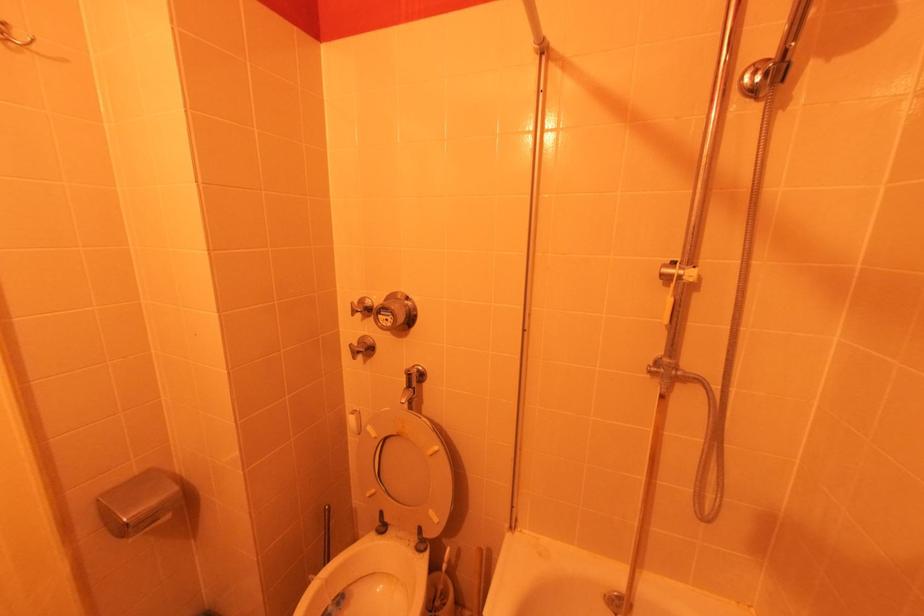
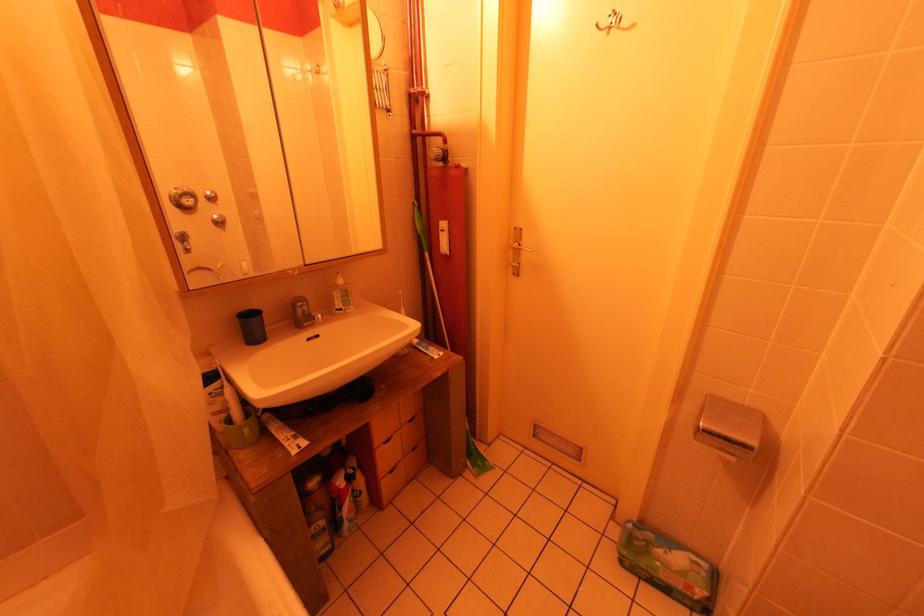
The first image is from the beginning of the video and the second image is from the end. How did the camera likely rotate when shooting the video?

The camera's rotation is toward left-down.